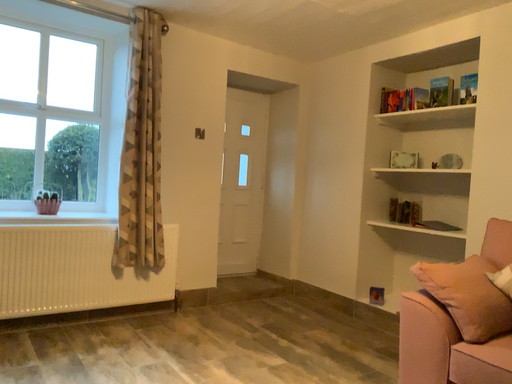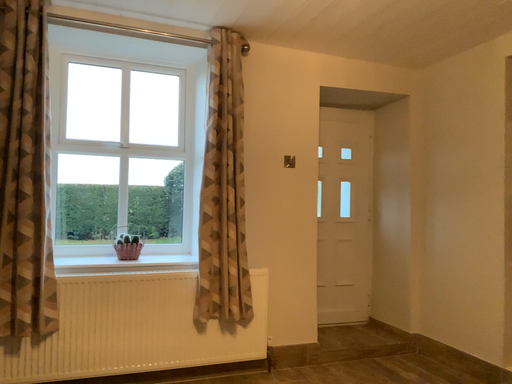
Question: How did the camera likely rotate when shooting the video?

Choices:
 (A) rotated right
 (B) rotated left

Answer: (B)